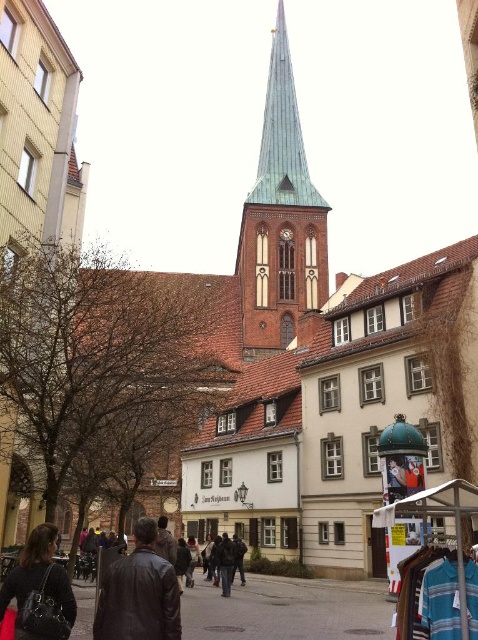
Identify the location of green copper spire at center. The image size is (478, 640). (281, 220).

Image resolution: width=478 pixels, height=640 pixels. What do you see at coordinates (281, 220) in the screenshot? I see `green copper spire at center` at bounding box center [281, 220].

At what (x,y) coordinates should I click in order to perform the action: click on green copper spire at center. Please return your answer as a coordinate pair (x, y). Looking at the image, I should click on (281, 220).

Find the location of a particular element. The height and width of the screenshot is (640, 478). green copper spire at center is located at coordinates (281, 220).

Is green copper spire at center to the right of leather jacket at center from the viewer's perspective?

Correct, you'll find green copper spire at center to the right of leather jacket at center.

Which is behind, point (285, 140) or point (165, 573)?

The point (285, 140) is more distant.

Locate an element on the screen. green copper spire at center is located at coordinates (281, 220).

Is leather jacket at center to the right of matte black jacket at lower left from the viewer's perspective?

Correct, you'll find leather jacket at center to the right of matte black jacket at lower left.

Between point (150, 577) and point (50, 620), which one is positioned in front?

Point (50, 620) is more forward.

This screenshot has height=640, width=478. Find the location of `leather jacket at center`. leather jacket at center is located at coordinates (139, 593).